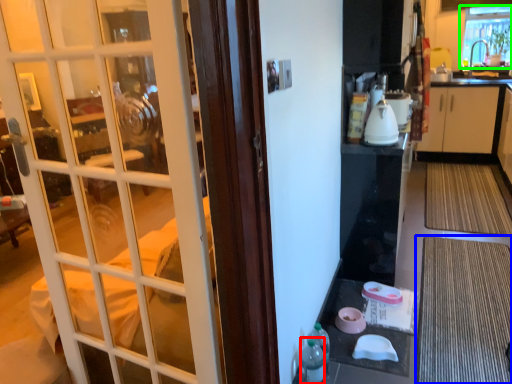
Question: Estimate the real-world distances between objects in this image. Which object is closer to bottle (highlighted by a red box), doormat (highlighted by a blue box) or window (highlighted by a green box)?

Choices:
 (A) doormat
 (B) window

Answer: (A)